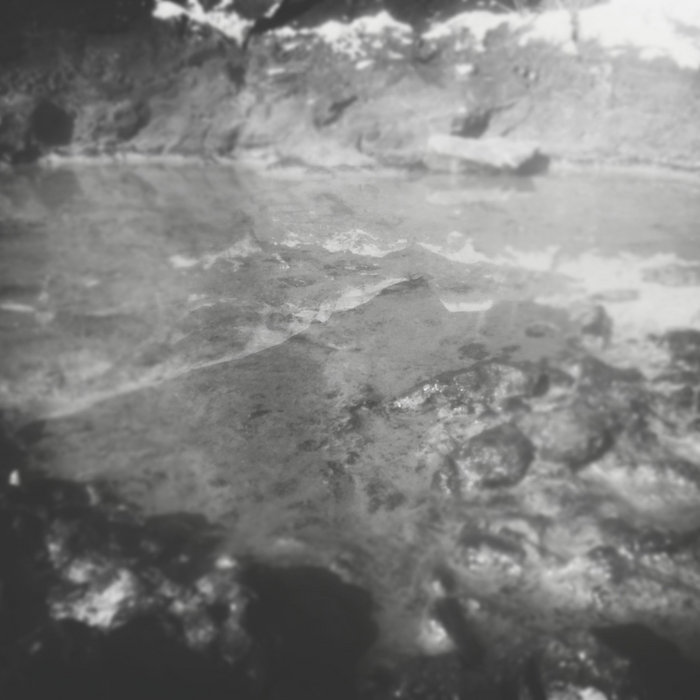
I want to click on art, so click(519, 321).